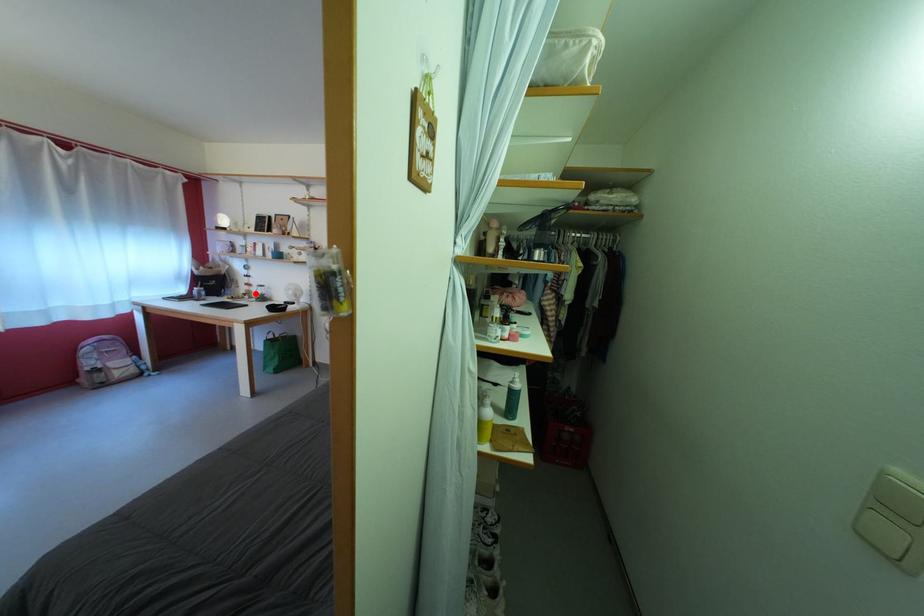
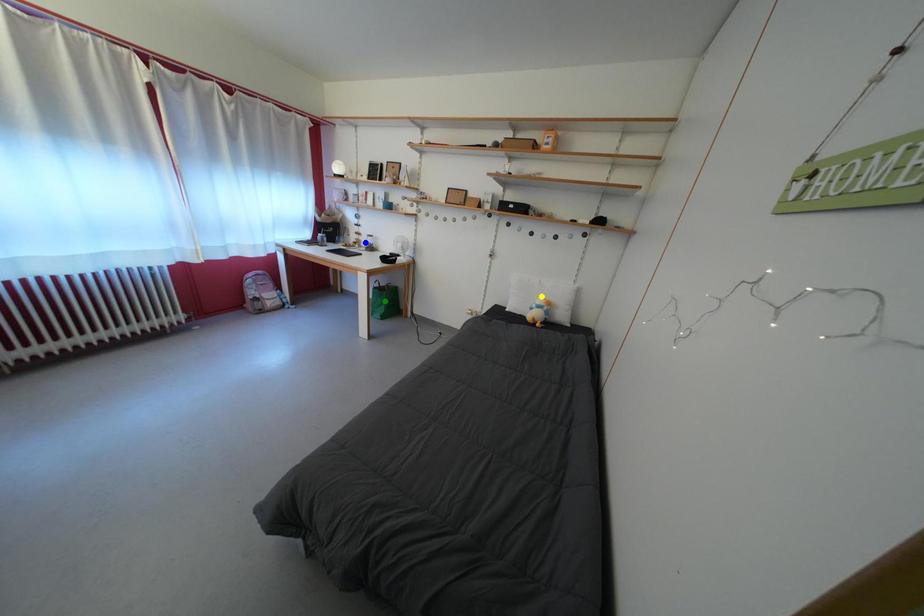
Question: I am providing you with two images of the same scene from different viewpoints. A red point is marked on the first image. You are given multiple points on the second image. Which spot in image 2 lines up with the point in image 1?

Choices:
 (A) yellow point
 (B) green point
 (C) blue point

Answer: (C)